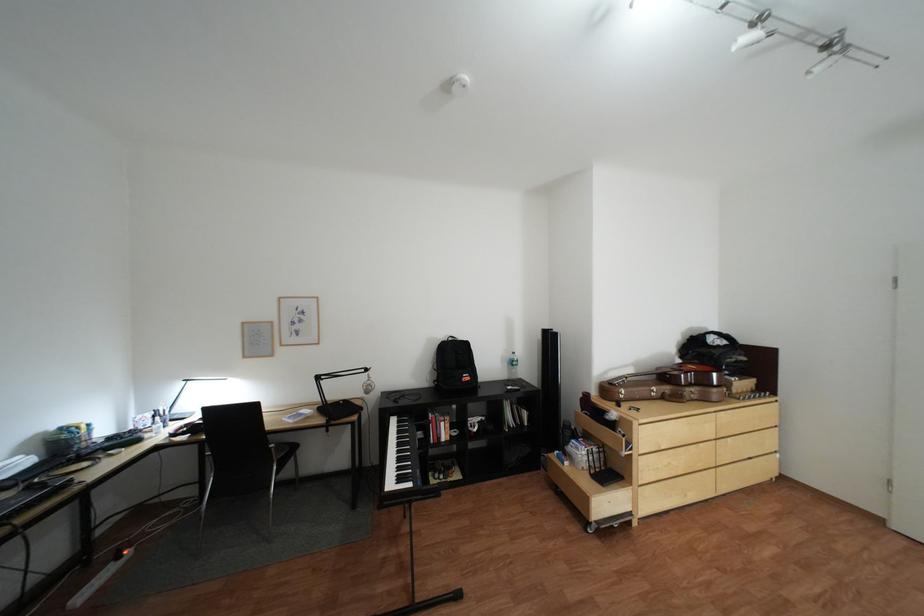
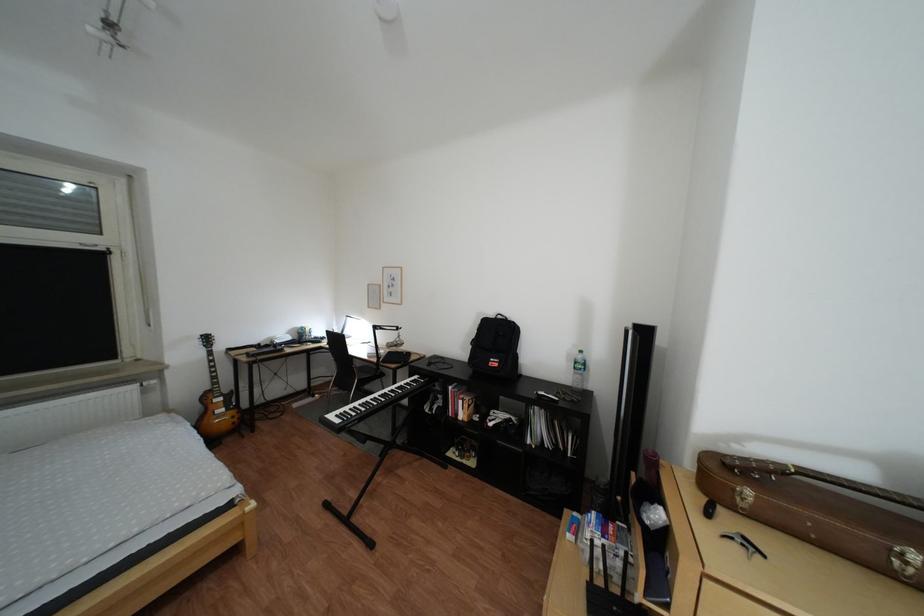
In the second image, find the point that corresponds to point (663, 389) in the first image.

(885, 537)